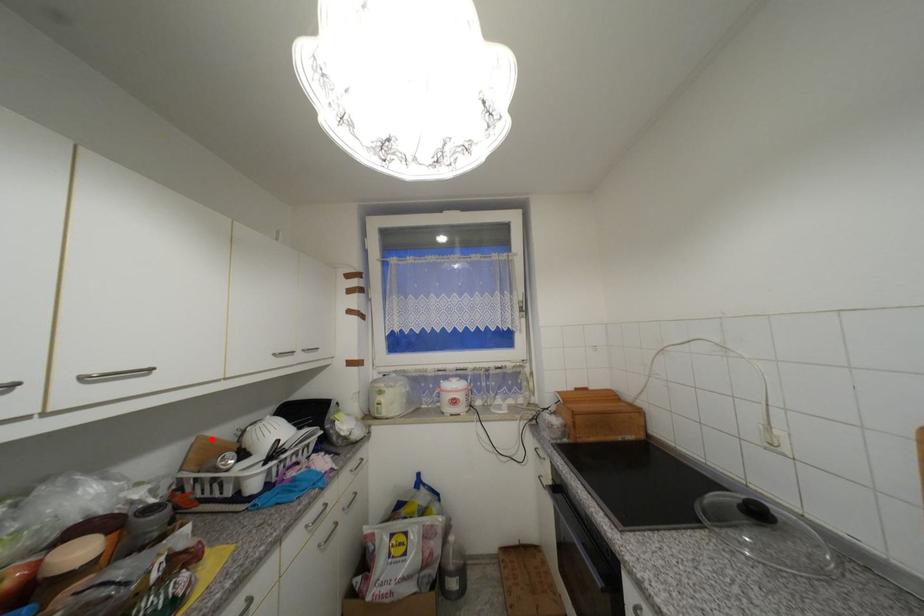
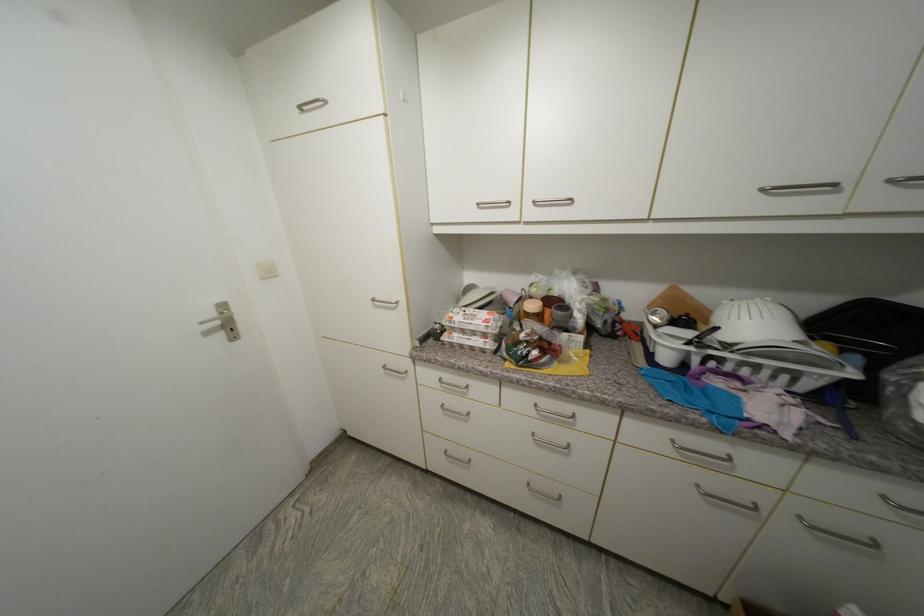
Find the pixel in the second image that matches the highlighted location in the first image.

(685, 292)